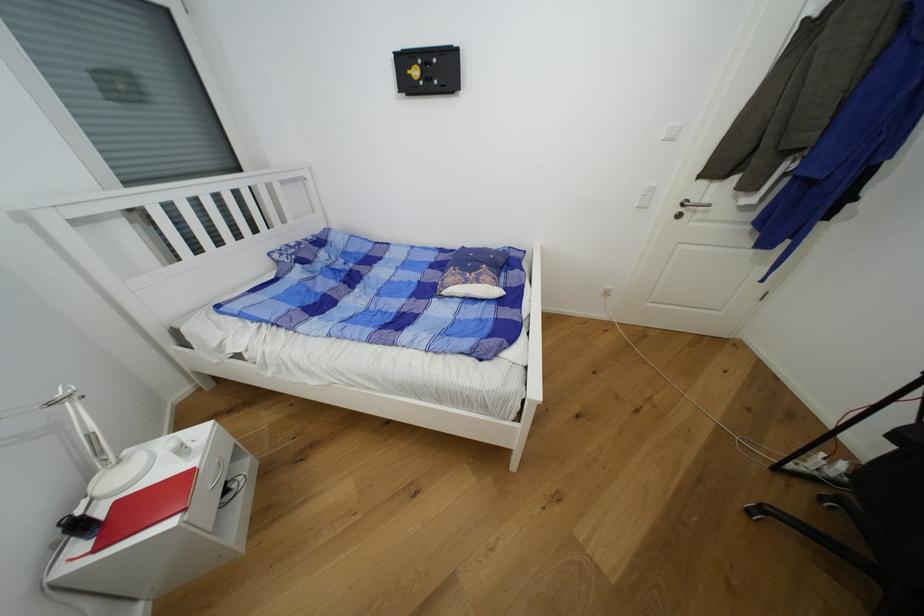
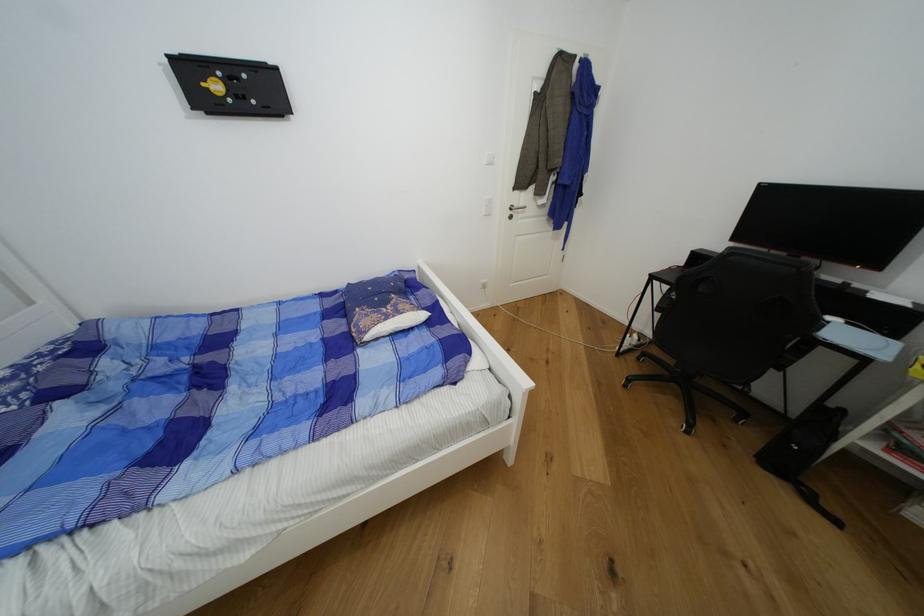
Find the pixel in the second image that matches pixel 482 283 in the first image.

(404, 314)